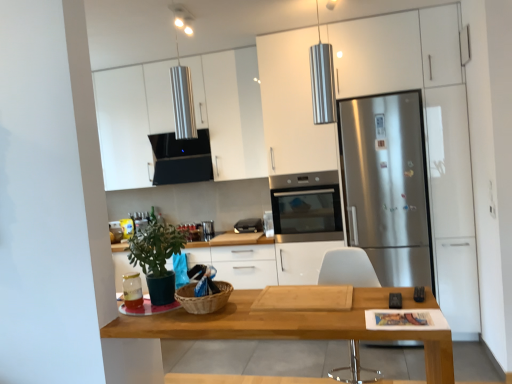
Locate an element on the screen. This screenshot has width=512, height=384. free location to the right of woven brown basket at center is located at coordinates (252, 307).